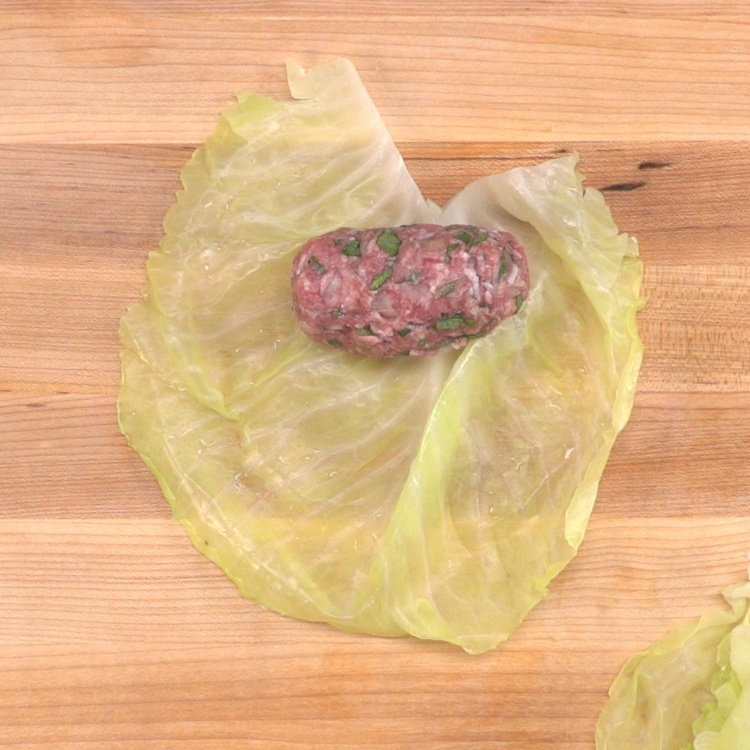
Locate an element on the screen. wood board is located at coordinates (79, 640).